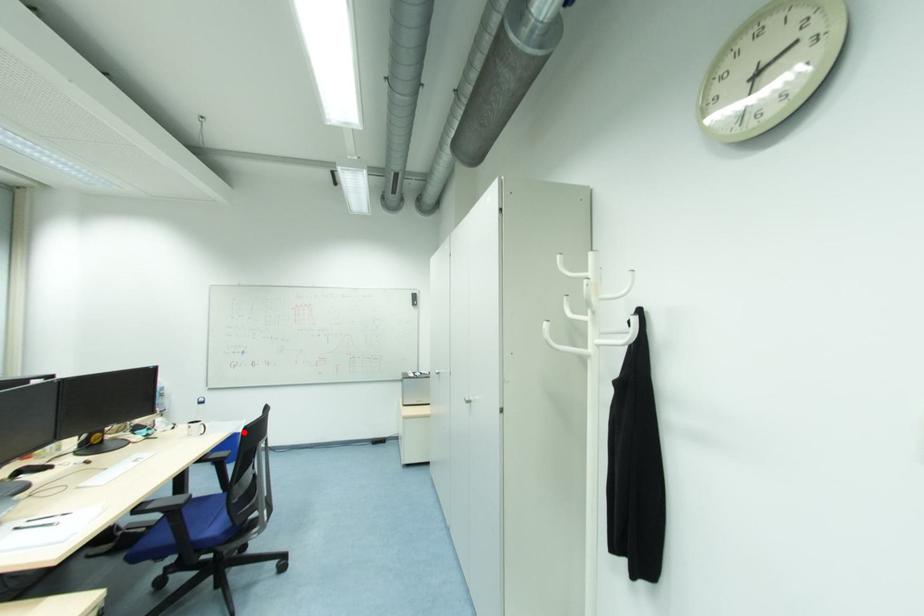
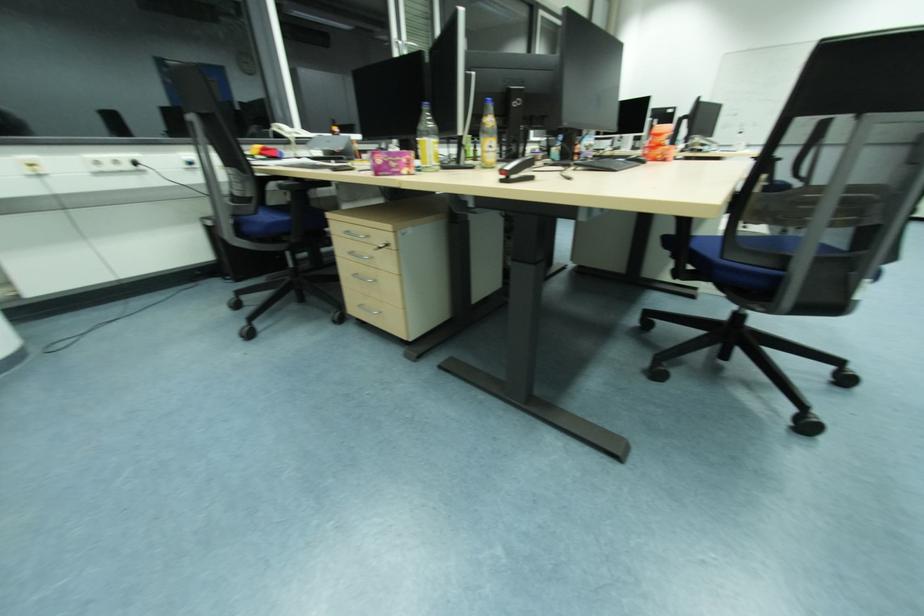
Question: I am providing you with two images of the same scene from different viewpoints. A red point is marked on the first image. Is the red point's position out of view in image 2?

Choices:
 (A) Yes
 (B) No

Answer: (A)